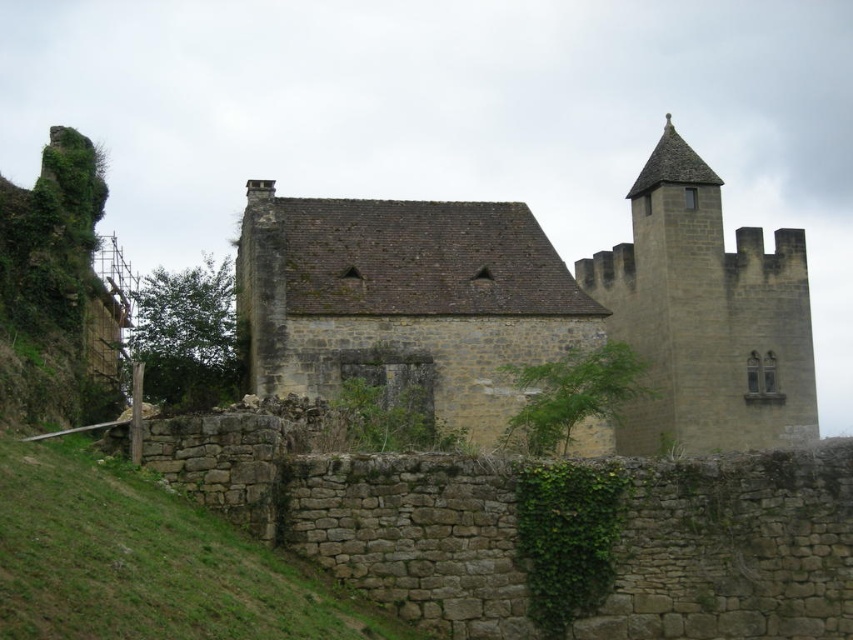
You are an architect examining the medieval stone building. You notice the brown stone tower at upper right and the green leafy ivy at center. Which object is closer to your viewpoint?

The brown stone tower at upper right is closer to the viewer than the green leafy ivy at center.